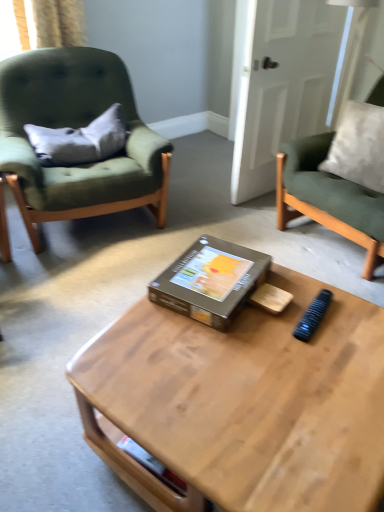
The width and height of the screenshot is (384, 512). I want to click on vacant area that lies to the right of brown cardboard box at center, so click(308, 304).